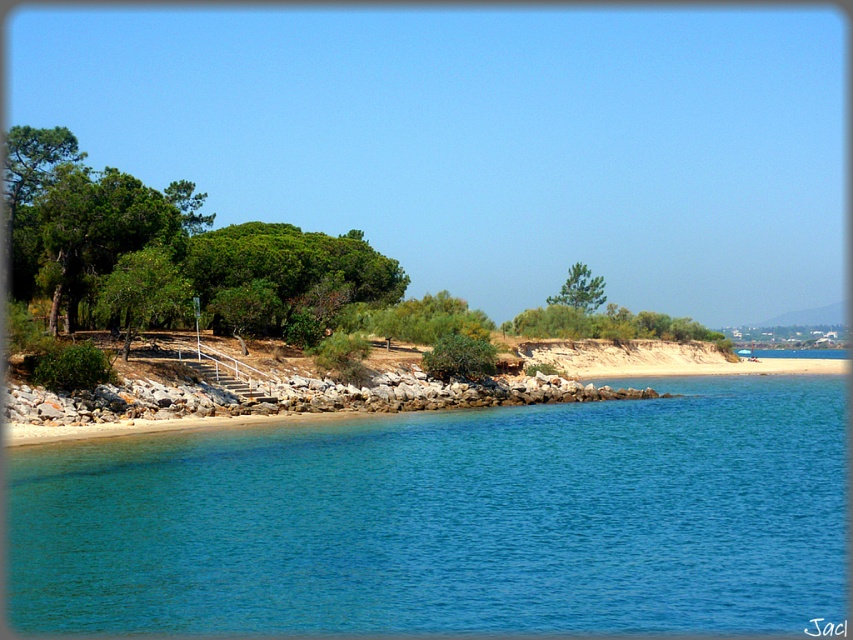
You are planning to set up a picnic area between the green leafy trees at left and the green textured tree at center. Which tree should you choose to place your picnic blanket closer to for more shade?

The green leafy trees at left might provide more shade since they are wider than the green textured tree at center.

You are standing at the beach and see two points marked on the sand. The first point is at coordinates point [352,273] and the second is at point [207,413]. If you are facing the ocean, which point is closer to you?

Point [207,413] is closer to you because it is in front of point [352,273] when facing the ocean.

You are standing on the beach and want to take a photo of both the clear blue water at lower left and the green textured tree at center. Which object will appear smaller in the photo?

The clear blue water at lower left will appear smaller in the photo because it is not as tall as the green textured tree at center.